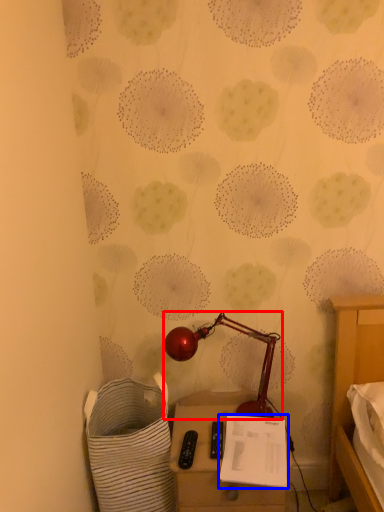
Question: Which object appears closest to the camera in this image, lamp (highlighted by a red box) or notepad (highlighted by a blue box)?

Choices:
 (A) lamp
 (B) notepad

Answer: (B)